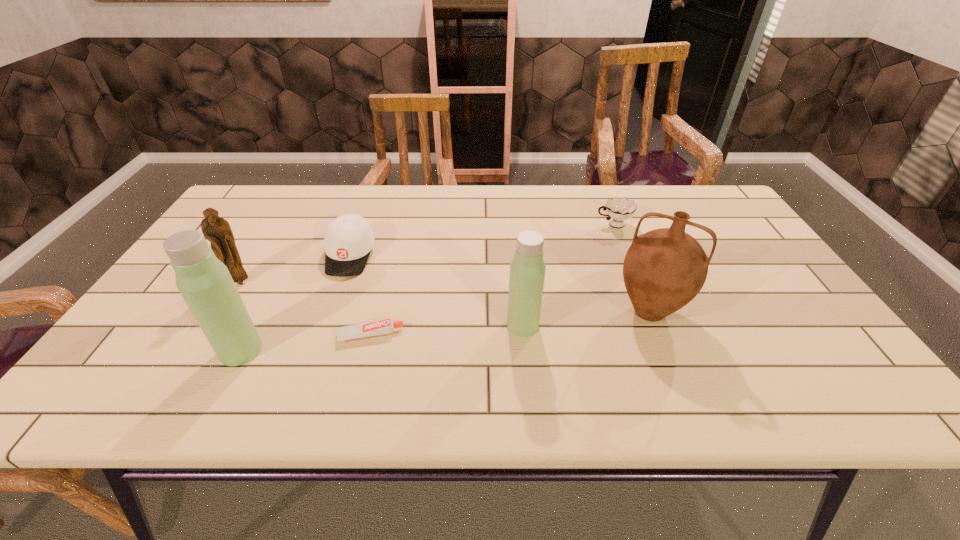
The image size is (960, 540). I want to click on the sixth object from right to left, so [204, 282].

Where is `the taller thermos bottle`? The height and width of the screenshot is (540, 960). the taller thermos bottle is located at coordinates (204, 282).

Find the location of a particular element. the right thermos bottle is located at coordinates [x=527, y=269].

Identify the location of the shorter thermos bottle. Image resolution: width=960 pixels, height=540 pixels. (527, 269).

The width and height of the screenshot is (960, 540). In order to click on the sixth tallest object in this screenshot , I will do `click(619, 209)`.

You are a GUI agent. You are given a task and a screenshot of the screen. Output one action in this format:
    pyautogui.click(x=<x>, y=<y>)
    Task: Click on the cup
    This screenshot has width=960, height=540.
    Given the screenshot: What is the action you would take?
    pyautogui.click(x=619, y=209)

Image resolution: width=960 pixels, height=540 pixels. What are the coordinates of `pitcher` in the screenshot? It's located at (664, 269).

Where is `the fifth tallest object`? The image size is (960, 540). the fifth tallest object is located at coordinates (349, 239).

You are a GUI agent. You are given a task and a screenshot of the screen. Output one action in this format:
    pyautogui.click(x=<x>, y=<y>)
    Task: Click on the figurine
    This screenshot has width=960, height=540.
    Given the screenshot: What is the action you would take?
    pyautogui.click(x=217, y=230)

Identify the location of the shortest object. This screenshot has height=540, width=960. click(386, 326).